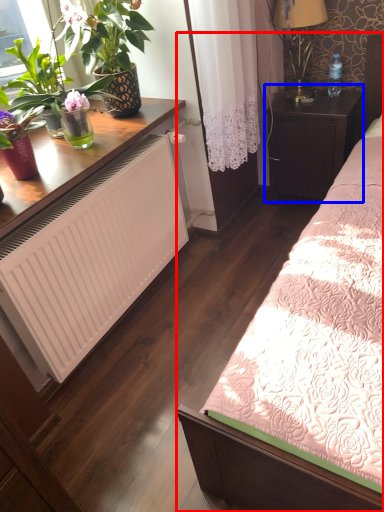
Question: Which object appears farthest to the camera in this image, bed (highlighted by a red box) or table (highlighted by a blue box)?

Choices:
 (A) bed
 (B) table

Answer: (B)